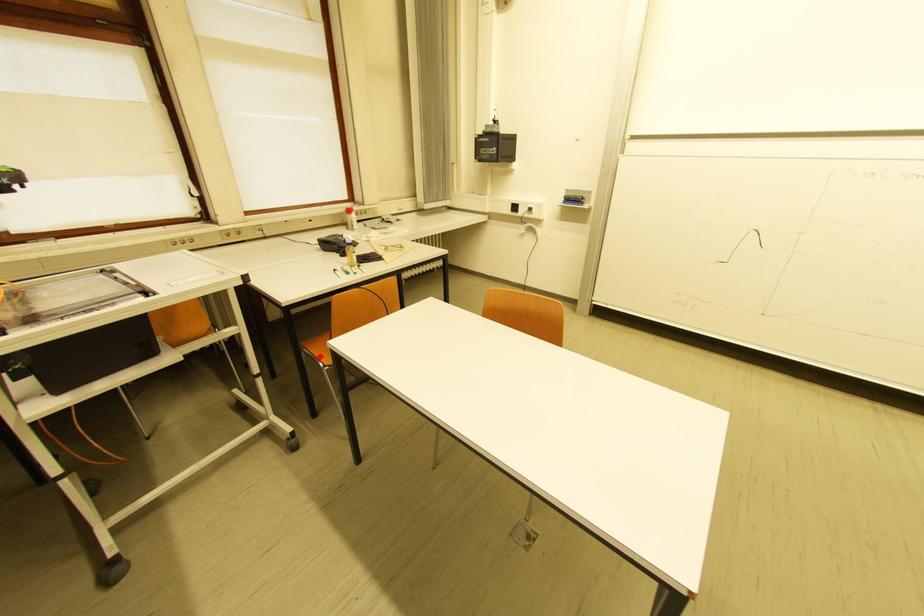
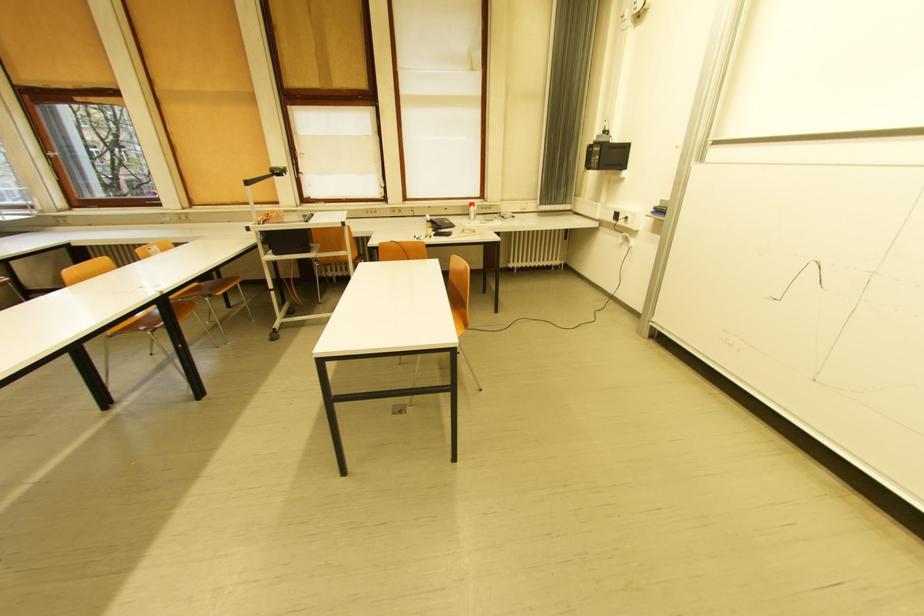
Question: I am providing you with two images of the same scene from different viewpoints. A red point is marked on the first image. Can you still see the location of the red point in image 2?

Choices:
 (A) Yes
 (B) No

Answer: (B)